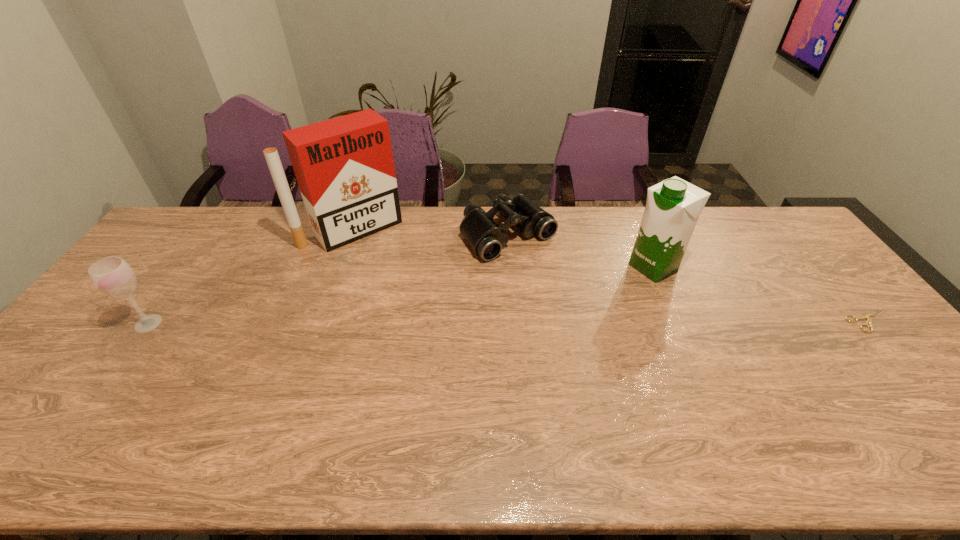
Find the location of a particular element. vacant space at the far right corner of the desktop is located at coordinates (764, 228).

Find the location of a particular element. unoccupied position between the rightmost object and the soya milk is located at coordinates (760, 294).

Locate an element on the screen. vacant area that lies between the shortest object and the fourth object from right to left is located at coordinates pos(611,275).

What are the coordinates of `free spot between the wineglass and the rightmost object` in the screenshot? It's located at (509, 322).

Locate an element on the screen. The height and width of the screenshot is (540, 960). vacant area that lies between the second shortest object and the leftmost object is located at coordinates click(328, 279).

The width and height of the screenshot is (960, 540). I want to click on vacant space in between the third shortest object and the fourth tallest object, so click(x=328, y=279).

At what (x,y) coordinates should I click in order to perform the action: click on vacant space that's between the shortest object and the second tallest object. Please return your answer as a coordinate pair (x, y). The image size is (960, 540). Looking at the image, I should click on (760, 294).

Identify the location of free space between the tallest object and the wineglass. The width and height of the screenshot is (960, 540). (251, 276).

Where is `empty location between the third shortest object and the soya milk`? empty location between the third shortest object and the soya milk is located at coordinates (400, 295).

Identify the location of vacant area that lies between the cigarette case and the shortest object. The image size is (960, 540). (611, 275).